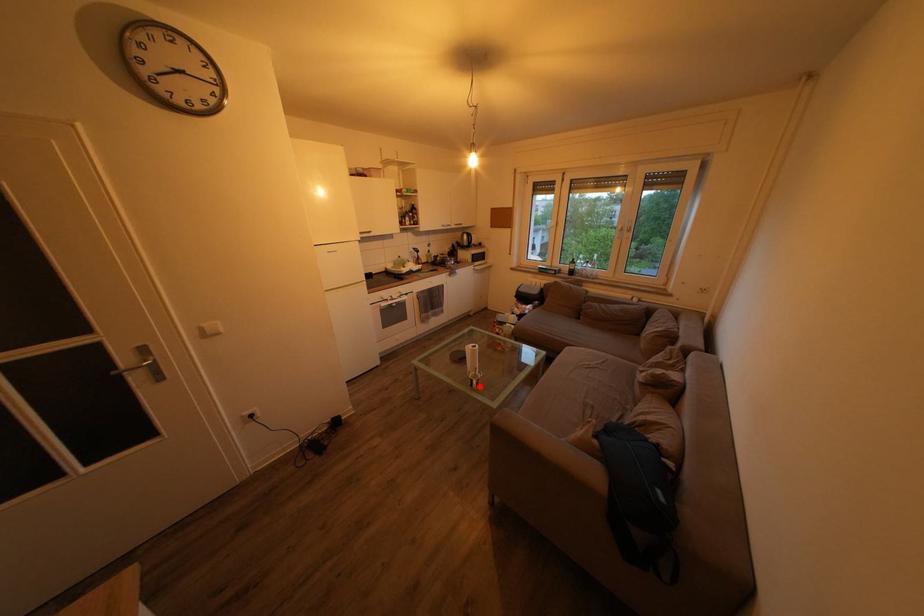
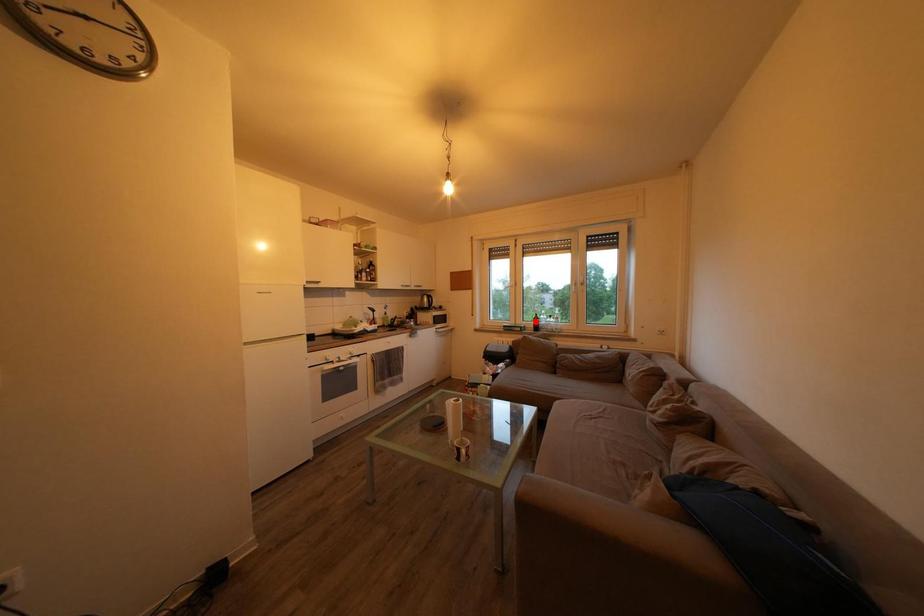
I am providing you with two images of the same scene from different viewpoints. A red point is marked on the first image and another point is marked on the second image. Is the marked point in image1 the same physical position as the marked point in image2?

No